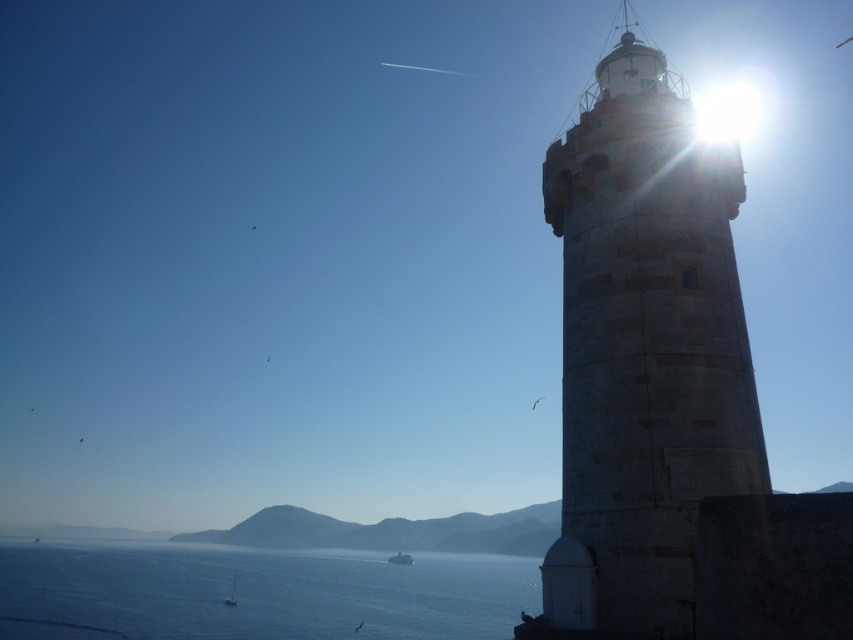
You are standing at the lighthouse and looking out towards the sea. There are two points marked in the scene. Which point, point [675,435] or point [91,621], is closer to you?

Point [675,435] is closer to the viewer than point [91,621].